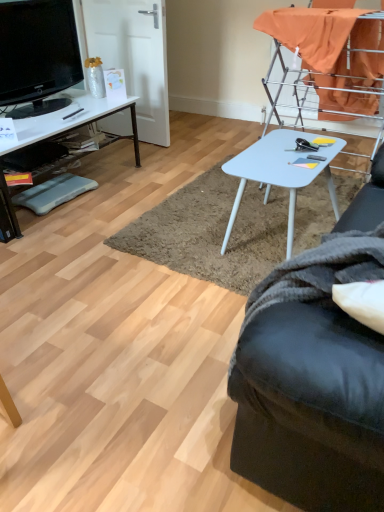
The image size is (384, 512). I want to click on free area behind black plastic pen at left, so pyautogui.click(x=76, y=106).